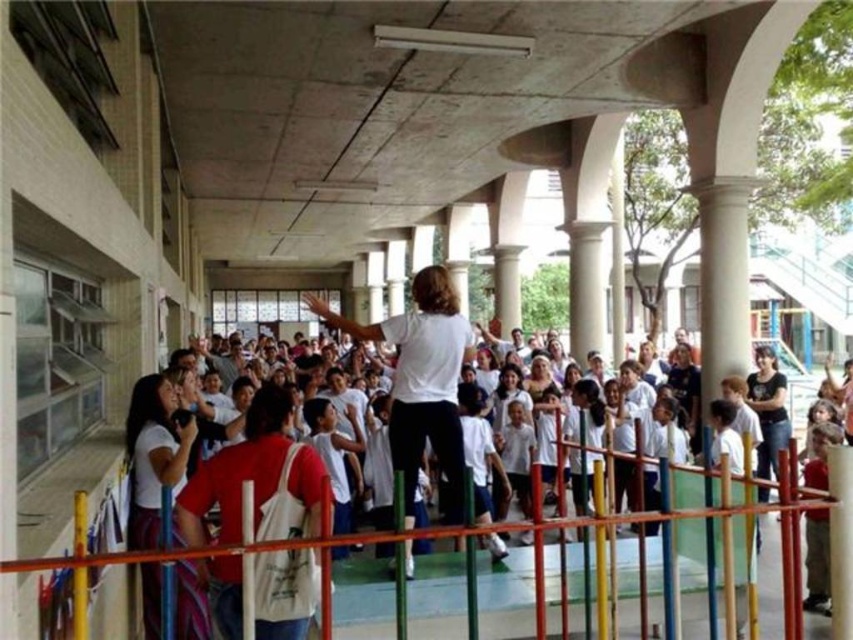
Find the location of a particular element. This screenshot has height=640, width=853. light brown wooden pole at right is located at coordinates (817, 561).

Which is behind, point (820, 602) or point (462, 438)?

Point (820, 602)

Does point (830, 442) lie in front of point (479, 406)?

Yes, it is.

You are a GUI agent. You are given a task and a screenshot of the screen. Output one action in this format:
    pyautogui.click(x=<x>, y=<y>)
    Task: Click on the light brown wooden pole at right
    
    Given the screenshot: What is the action you would take?
    click(x=817, y=561)

Can you confirm if multicolored plastic fence at center is thinner than red cotton t-shirt at center?

Incorrect, multicolored plastic fence at center's width is not less than red cotton t-shirt at center's.

Who is more distant from viewer, (392, 600) or (204, 540)?

The point (392, 600) is more distant.

Which is behind, point (578, 588) or point (190, 500)?

Point (578, 588)

At what (x,y) coordinates should I click in order to perform the action: click on multicolored plastic fence at center. Please return your answer as a coordinate pair (x, y). Looking at the image, I should click on (508, 600).

Is multicolored plastic fence at center below white cotton shirt at center?

Yes.

Is point (627, 554) closer to camera compared to point (486, 481)?

Yes, it is in front of point (486, 481).

Find the location of `multicolored plastic fence at center`. multicolored plastic fence at center is located at coordinates (508, 600).